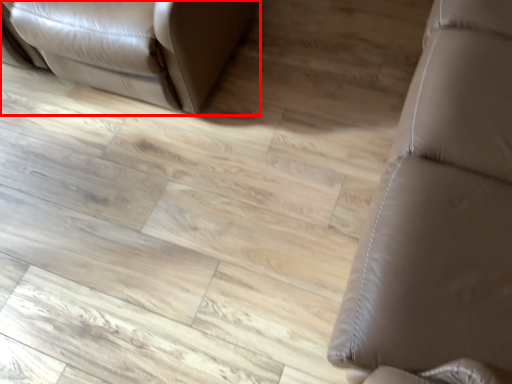
Question: Observing the image, what is the correct spatial positioning of furniture (annotated by the red box) in reference to furniture?

Choices:
 (A) right
 (B) left

Answer: (B)